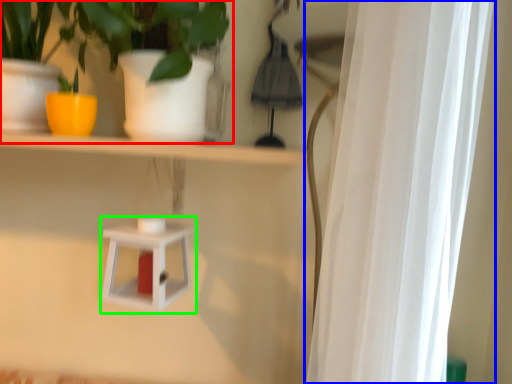
Question: Based on their relative distances, which object is farther from houseplant (highlighted by a red box)? Choose from curtain (highlighted by a blue box) and shelf (highlighted by a green box).

Choices:
 (A) curtain
 (B) shelf

Answer: (A)